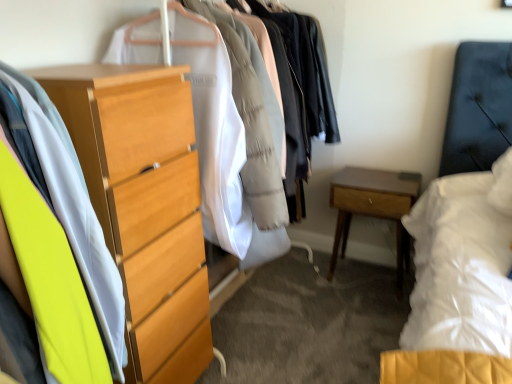
Find the location of a particular element. This screenshot has width=512, height=384. light wood dresser at left, which is counted as the 1th closet, starting from the front is located at coordinates (126, 141).

I want to click on light brown wood nightstand at lower right, so click(373, 207).

Identify the location of wooden chest of drawers at center, which ranks as the second closet in front-to-back order. This screenshot has width=512, height=384. (220, 142).

Is point (189, 265) closer to viewer compared to point (392, 182)?

Yes, point (189, 265) is in front of point (392, 182).

Locate an element on the screen. nightstand below the light wood chest of drawers at left (from a real-world perspective) is located at coordinates (373, 207).

Is light brown wood nightstand at lower right at the back of light wood chest of drawers at left?

→ No, light wood chest of drawers at left is not facing away from light brown wood nightstand at lower right.

How much distance is there between light wood chest of drawers at left and light brown wood nightstand at lower right?

light wood chest of drawers at left is 3.63 feet from light brown wood nightstand at lower right.

From the image's perspective, is wooden chest of drawers at center, which ranks as the second closet in front-to-back order, located beneath light wood dresser at left, which is counted as the 1th closet, starting from the front?

No, from the image's perspective, wooden chest of drawers at center, which ranks as the second closet in front-to-back order, is not beneath light wood dresser at left, which is counted as the 1th closet, starting from the front.

Does wooden chest of drawers at center, which ranks as the second closet in front-to-back order, have a lesser width compared to light wood dresser at left, which is the second closet in back-to-front order?

No.

Which is behind, wooden chest of drawers at center, which ranks as the second closet in front-to-back order, or light wood dresser at left, which is the second closet in back-to-front order?

wooden chest of drawers at center, which ranks as the second closet in front-to-back order, is further from the camera.

Is wooden chest of drawers at center, arranged as the 1th closet when viewed from the back, next to light wood dresser at left, which is the second closet in back-to-front order?

There is a gap between wooden chest of drawers at center, arranged as the 1th closet when viewed from the back, and light wood dresser at left, which is the second closet in back-to-front order.

I want to click on the 2nd closet above when counting from the light brown wood nightstand at lower right (from the image's perspective), so click(x=220, y=142).

Can light brown wood nightstand at lower right be found inside wooden chest of drawers at center, arranged as the 1th closet when viewed from the back?

No, light brown wood nightstand at lower right is not surrounded by wooden chest of drawers at center, arranged as the 1th closet when viewed from the back.

Does wooden chest of drawers at center, which ranks as the second closet in front-to-back order, have a lesser width compared to light brown wood nightstand at lower right?

Incorrect, the width of wooden chest of drawers at center, which ranks as the second closet in front-to-back order, is not less than that of light brown wood nightstand at lower right.

Is wooden chest of drawers at center, arranged as the 1th closet when viewed from the back, to the left of light brown wood nightstand at lower right from the viewer's perspective?

Correct, you'll find wooden chest of drawers at center, arranged as the 1th closet when viewed from the back, to the left of light brown wood nightstand at lower right.

How distant is light brown wood nightstand at lower right from light wood chest of drawers at left?

They are 3.63 feet apart.

How different are the orientations of light brown wood nightstand at lower right and light wood chest of drawers at left in degrees?

The angular difference between light brown wood nightstand at lower right and light wood chest of drawers at left is 91.7 degrees.

Does light brown wood nightstand at lower right have a greater width compared to light wood chest of drawers at left?

Incorrect, the width of light brown wood nightstand at lower right does not surpass that of light wood chest of drawers at left.

Is light brown wood nightstand at lower right completely or partially outside of light wood chest of drawers at left?

light brown wood nightstand at lower right is positioned outside light wood chest of drawers at left.

Between light wood chest of drawers at left and wooden chest of drawers at center, which ranks as the second closet in front-to-back order, which one has smaller width?

With smaller width is light wood chest of drawers at left.

From the picture: Considering their positions, is light wood chest of drawers at left located in front of or behind wooden chest of drawers at center, arranged as the 1th closet when viewed from the back?

Clearly, light wood chest of drawers at left is in front of wooden chest of drawers at center, arranged as the 1th closet when viewed from the back.

Who is shorter, light wood chest of drawers at left or wooden chest of drawers at center, arranged as the 1th closet when viewed from the back?

wooden chest of drawers at center, arranged as the 1th closet when viewed from the back, is shorter.

From a real-world perspective, does light wood dresser at left, which is counted as the 1th closet, starting from the front, sit lower than light wood chest of drawers at left?

No.

From the picture: In terms of width, does light wood dresser at left, which is the second closet in back-to-front order, look wider or thinner when compared to light wood chest of drawers at left?

Considering their sizes, light wood dresser at left, which is the second closet in back-to-front order, looks broader than light wood chest of drawers at left.

From the picture: Is light wood dresser at left, which is the second closet in back-to-front order, closer to camera compared to light wood chest of drawers at left?

No, light wood dresser at left, which is the second closet in back-to-front order, is behind light wood chest of drawers at left.

Can you tell me how much light wood dresser at left, which is counted as the 1th closet, starting from the front, and light brown wood nightstand at lower right differ in facing direction?

89.3 degrees.

Considering the positions of objects light wood dresser at left, which is counted as the 1th closet, starting from the front, and light brown wood nightstand at lower right in the image provided, who is more to the left, light wood dresser at left, which is counted as the 1th closet, starting from the front, or light brown wood nightstand at lower right?

Positioned to the left is light wood dresser at left, which is counted as the 1th closet, starting from the front.

Between light wood dresser at left, which is the second closet in back-to-front order, and light brown wood nightstand at lower right, which one has smaller size?

With smaller size is light brown wood nightstand at lower right.

Considering the positions of objects light wood dresser at left, which is counted as the 1th closet, starting from the front, and light brown wood nightstand at lower right in the image provided, who is behind, light wood dresser at left, which is counted as the 1th closet, starting from the front, or light brown wood nightstand at lower right?

light brown wood nightstand at lower right is more distant.

Find the location of a particular element. the chest of drawers located above the light brown wood nightstand at lower right (from the image's perspective) is located at coordinates (144, 205).

At what (x,y) coordinates should I click in order to perform the action: click on closet in front of the wooden chest of drawers at center, arranged as the 1th closet when viewed from the back. Please return your answer as a coordinate pair (x, y). This screenshot has height=384, width=512. Looking at the image, I should click on point(126,141).

Looking at the image, which one is located closer to light wood dresser at left, which is the second closet in back-to-front order, wooden chest of drawers at center, which ranks as the second closet in front-to-back order, or light wood chest of drawers at left?

light wood chest of drawers at left.

Based on their spatial positions, is light wood dresser at left, which is counted as the 1th closet, starting from the front, or light brown wood nightstand at lower right closer to light wood chest of drawers at left?

Among the two, light wood dresser at left, which is counted as the 1th closet, starting from the front, is located nearer to light wood chest of drawers at left.

Considering their positions, is light wood dresser at left, which is counted as the 1th closet, starting from the front, positioned further to wooden chest of drawers at center, which ranks as the second closet in front-to-back order, than light wood chest of drawers at left?

Among the two, light wood dresser at left, which is counted as the 1th closet, starting from the front, is located further to wooden chest of drawers at center, which ranks as the second closet in front-to-back order.

Based on their spatial positions, is wooden chest of drawers at center, arranged as the 1th closet when viewed from the back, or light brown wood nightstand at lower right closer to light wood chest of drawers at left?

The object closer to light wood chest of drawers at left is wooden chest of drawers at center, arranged as the 1th closet when viewed from the back.

Looking at the image, which one is located closer to wooden chest of drawers at center, arranged as the 1th closet when viewed from the back, light wood chest of drawers at left or light wood dresser at left, which is the second closet in back-to-front order?

light wood chest of drawers at left is positioned closer to the anchor wooden chest of drawers at center, arranged as the 1th closet when viewed from the back.

When comparing their distances from light brown wood nightstand at lower right, does light wood chest of drawers at left or wooden chest of drawers at center, which ranks as the second closet in front-to-back order, seem closer?

wooden chest of drawers at center, which ranks as the second closet in front-to-back order, is positioned closer to the anchor light brown wood nightstand at lower right.

Based on their spatial positions, is light wood dresser at left, which is the second closet in back-to-front order, or wooden chest of drawers at center, which ranks as the second closet in front-to-back order, further from light wood chest of drawers at left?

wooden chest of drawers at center, which ranks as the second closet in front-to-back order, is positioned further to the anchor light wood chest of drawers at left.

From the image, which object appears to be nearer to light wood dresser at left, which is counted as the 1th closet, starting from the front, light brown wood nightstand at lower right or light wood chest of drawers at left?

light wood chest of drawers at left is positioned closer to the anchor light wood dresser at left, which is counted as the 1th closet, starting from the front.

Find the location of a particular element. The width and height of the screenshot is (512, 384). closet between wooden chest of drawers at center, which ranks as the second closet in front-to-back order, and light brown wood nightstand at lower right from left to right is located at coordinates (126, 141).

Where is `closet between wooden chest of drawers at center, which ranks as the second closet in front-to-back order, and light wood chest of drawers at left, in the vertical direction`? This screenshot has height=384, width=512. closet between wooden chest of drawers at center, which ranks as the second closet in front-to-back order, and light wood chest of drawers at left, in the vertical direction is located at coordinates (126, 141).